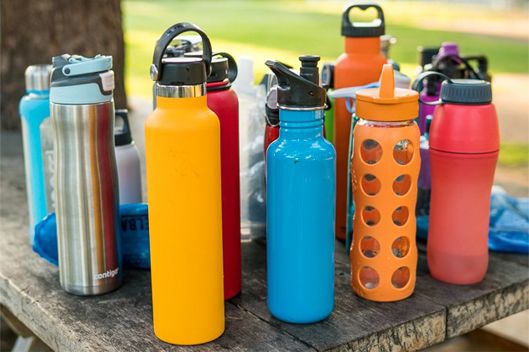
I want to click on boards in table, so click(x=244, y=338), click(x=343, y=321), click(x=490, y=281), click(x=519, y=257).